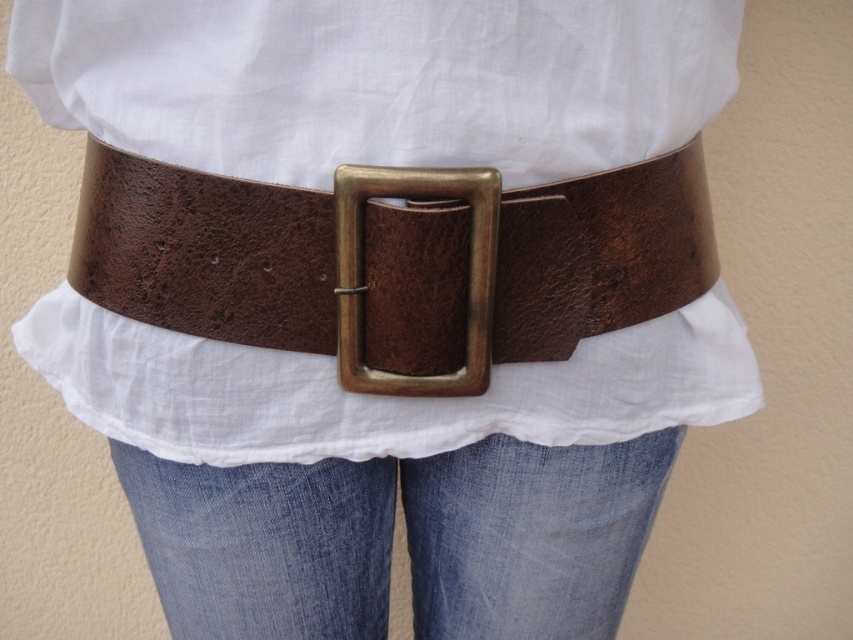
Question: Observing the image, what is the correct spatial positioning of white cotton shirt at center in reference to brown leather belt at center?

Choices:
 (A) right
 (B) left

Answer: (B)

Question: Which point is closer to the camera?

Choices:
 (A) (610, 52)
 (B) (541, 296)
 (C) (518, 456)
 (D) (444, 188)

Answer: (D)

Question: Which object is farther from the camera taking this photo?

Choices:
 (A) white cotton shirt at center
 (B) brown leather belt at center
 (C) denim at center
 (D) antique brass buckle at center

Answer: (C)

Question: In this image, where is white cotton shirt at center located relative to antique brass buckle at center?

Choices:
 (A) above
 (B) below

Answer: (A)

Question: Which object is the farthest from the white cotton shirt at center?

Choices:
 (A) denim at center
 (B) antique brass buckle at center
 (C) brown leather belt at center

Answer: (A)

Question: Does white cotton shirt at center come behind brown leather belt at center?

Choices:
 (A) yes
 (B) no

Answer: (B)